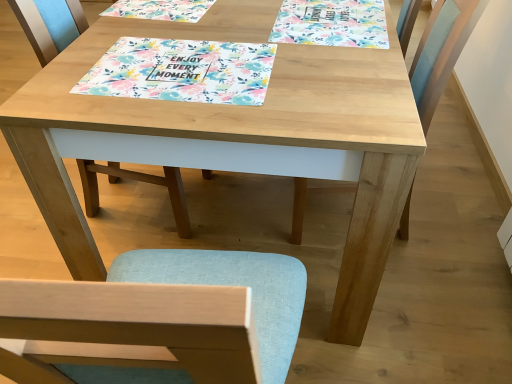
How much space does light blue fabric chair at center, the first chair in the left-to-right sequence, occupy horizontally?

light blue fabric chair at center, the first chair in the left-to-right sequence, is 19.78 inches wide.

Measure the distance between point (x=115, y=166) and camera.

Point (x=115, y=166) is 1.91 meters away from camera.

Locate an element on the screen. The height and width of the screenshot is (384, 512). light blue fabric chair at right, the 2th chair when ordered from left to right is located at coordinates (441, 51).

Can you tell me how much floral paper placemat at upper center and floral paper placemat at center differ in facing direction?

2.14 degrees.

Considering the relative positions of floral paper placemat at upper center and floral paper placemat at center in the image provided, is floral paper placemat at upper center behind floral paper placemat at center?

Yes, floral paper placemat at upper center is further from the camera.

From a real-world perspective, is floral paper placemat at upper center located higher than floral paper placemat at center?

No, from a real-world perspective, floral paper placemat at upper center is not over floral paper placemat at center

Which is closer, (328, 16) or (146, 48)?

Positioned in front is point (146, 48).

Does floral paper placemat at center appear on the right side of light blue fabric chair at center, the first chair in the left-to-right sequence?

Yes, floral paper placemat at center is to the right of light blue fabric chair at center, the first chair in the left-to-right sequence.

Considering the relative sizes of floral paper placemat at center and light blue fabric chair at center, the first chair in the left-to-right sequence, in the image provided, is floral paper placemat at center wider than light blue fabric chair at center, the first chair in the left-to-right sequence,?

No.

Is there a large distance between floral paper placemat at center and light blue fabric chair at center, the first chair in the left-to-right sequence?

No, floral paper placemat at center is not far from light blue fabric chair at center, the first chair in the left-to-right sequence.

Can you confirm if floral paper placemat at upper center is taller than light blue fabric chair at right, the 2th chair when ordered from left to right?

No.

Considering the relative sizes of floral paper placemat at upper center and light blue fabric chair at right, which is the first chair from right to left, in the image provided, is floral paper placemat at upper center smaller than light blue fabric chair at right, which is the first chair from right to left,?

Yes, floral paper placemat at upper center is smaller than light blue fabric chair at right, which is the first chair from right to left.

Locate an element on the screen. book cover above the light blue fabric chair at right, which is the first chair from right to left (from a real-world perspective) is located at coordinates (332, 23).

Considering the positions of objects floral paper placemat at upper center and light blue fabric chair at right, the 2th chair when ordered from left to right, in the image provided, who is behind, floral paper placemat at upper center or light blue fabric chair at right, the 2th chair when ordered from left to right,?

floral paper placemat at upper center is further away from the camera.

Between point (69, 36) and point (180, 46), which one is positioned behind?

Positioned behind is point (69, 36).

Do you think light blue fabric chair at center, the first chair in the left-to-right sequence, is within floral paper placemat at center, or outside of it?

light blue fabric chair at center, the first chair in the left-to-right sequence, exists outside the volume of floral paper placemat at center.

Where is `chair on the left of floral paper placemat at center`? chair on the left of floral paper placemat at center is located at coordinates (49, 25).

Can you confirm if light blue fabric chair at center, the first chair in the left-to-right sequence, is wider than floral paper placemat at center?

Yes, light blue fabric chair at center, the first chair in the left-to-right sequence, is wider than floral paper placemat at center.

Considering the positions of objects light blue fabric chair at center, the second chair when ordered from right to left, and floral paper placemat at upper center in the image provided, who is more to the left, light blue fabric chair at center, the second chair when ordered from right to left, or floral paper placemat at upper center?

light blue fabric chair at center, the second chair when ordered from right to left, is more to the left.

Considering the points (69, 11) and (325, 5), which point is in front, point (69, 11) or point (325, 5)?

The point (325, 5) is more forward.

How different are the orientations of light blue fabric chair at center, the first chair in the left-to-right sequence, and floral paper placemat at upper center in degrees?

They differ by 178 degrees in their facing directions.

Could you tell me if light blue fabric chair at center, the first chair in the left-to-right sequence, is turned towards floral paper placemat at upper center?

Yes, light blue fabric chair at center, the first chair in the left-to-right sequence, faces towards floral paper placemat at upper center.

Can you confirm if light blue fabric chair at center, the second chair when ordered from right to left, is positioned to the right of light blue fabric chair at right, which is the first chair from right to left?

Incorrect, light blue fabric chair at center, the second chair when ordered from right to left, is not on the right side of light blue fabric chair at right, which is the first chair from right to left.

What's the angular difference between light blue fabric chair at center, the second chair when ordered from right to left, and light blue fabric chair at right, the 2th chair when ordered from left to right,'s facing directions?

They differ by 180 degrees in their facing directions.

Locate an element on the screen. This screenshot has width=512, height=384. chair below the light blue fabric chair at center, the second chair when ordered from right to left (from the image's perspective) is located at coordinates (441, 51).

Is point (333, 16) positioned after point (58, 25)?

No, (333, 16) is in front of (58, 25).

Relative to light blue fabric chair at center, the first chair in the left-to-right sequence, is floral paper placemat at upper center in front or behind?

floral paper placemat at upper center is positioned farther from the viewer than light blue fabric chair at center, the first chair in the left-to-right sequence.

Considering the relative sizes of floral paper placemat at upper center and light blue fabric chair at center, the second chair when ordered from right to left, in the image provided, is floral paper placemat at upper center smaller than light blue fabric chair at center, the second chair when ordered from right to left,?

Correct, floral paper placemat at upper center occupies less space than light blue fabric chair at center, the second chair when ordered from right to left.

Which is more to the right, floral paper placemat at upper center or light blue fabric chair at center, the second chair when ordered from right to left?

From the viewer's perspective, floral paper placemat at upper center appears more on the right side.

The height and width of the screenshot is (384, 512). I want to click on tablecloth in front of the floral paper placemat at upper center, so click(182, 71).

This screenshot has height=384, width=512. In order to click on the 2nd chair behind when counting from the floral paper placemat at center in this screenshot , I will do `click(49, 25)`.

Which object lies nearer to the anchor point floral paper placemat at center, light blue fabric chair at right, which is the first chair from right to left, or light blue fabric chair at center, the second chair when ordered from right to left?

light blue fabric chair at center, the second chair when ordered from right to left, is positioned closer to the anchor floral paper placemat at center.

When comparing their distances from floral paper placemat at upper center, does floral paper placemat at center or light blue fabric chair at center, the second chair when ordered from right to left, seem further?

light blue fabric chair at center, the second chair when ordered from right to left, is further to floral paper placemat at upper center.

Estimate the real-world distances between objects in this image. Which object is closer to floral paper placemat at center, light blue fabric chair at center, the second chair when ordered from right to left, or light blue fabric chair at right, which is the first chair from right to left?

The object closer to floral paper placemat at center is light blue fabric chair at center, the second chair when ordered from right to left.

Estimate the real-world distances between objects in this image. Which object is closer to floral paper placemat at upper center, floral paper placemat at center or light blue fabric chair at right, which is the first chair from right to left?

Based on the image, light blue fabric chair at right, which is the first chair from right to left, appears to be nearer to floral paper placemat at upper center.

Which object lies further to the anchor point floral paper placemat at center, light blue fabric chair at right, the 2th chair when ordered from left to right, or floral paper placemat at upper center?

The object further to floral paper placemat at center is light blue fabric chair at right, the 2th chair when ordered from left to right.

Estimate the real-world distances between objects in this image. Which object is closer to floral paper placemat at upper center, light blue fabric chair at right, the 2th chair when ordered from left to right, or light blue fabric chair at center, the second chair when ordered from right to left?

light blue fabric chair at right, the 2th chair when ordered from left to right, lies closer to floral paper placemat at upper center than the other object.

From the image, which object appears to be farther from light blue fabric chair at center, the second chair when ordered from right to left, floral paper placemat at center or floral paper placemat at upper center?

floral paper placemat at upper center.

Which object lies nearer to the anchor point light blue fabric chair at center, the second chair when ordered from right to left, floral paper placemat at center or light blue fabric chair at right, which is the first chair from right to left?

The object closer to light blue fabric chair at center, the second chair when ordered from right to left, is floral paper placemat at center.

This screenshot has width=512, height=384. I want to click on tablecloth located between light blue fabric chair at center, the second chair when ordered from right to left, and floral paper placemat at upper center in the left-right direction, so [x=182, y=71].

The image size is (512, 384). I want to click on book cover between light blue fabric chair at center, the second chair when ordered from right to left, and light blue fabric chair at right, which is the first chair from right to left, so click(332, 23).

Locate an element on the screen. The width and height of the screenshot is (512, 384). book cover between floral paper placemat at center and light blue fabric chair at right, which is the first chair from right to left, from left to right is located at coordinates (332, 23).

Locate an element on the screen. The height and width of the screenshot is (384, 512). tablecloth situated between light blue fabric chair at center, the first chair in the left-to-right sequence, and light blue fabric chair at right, which is the first chair from right to left, from left to right is located at coordinates (182, 71).